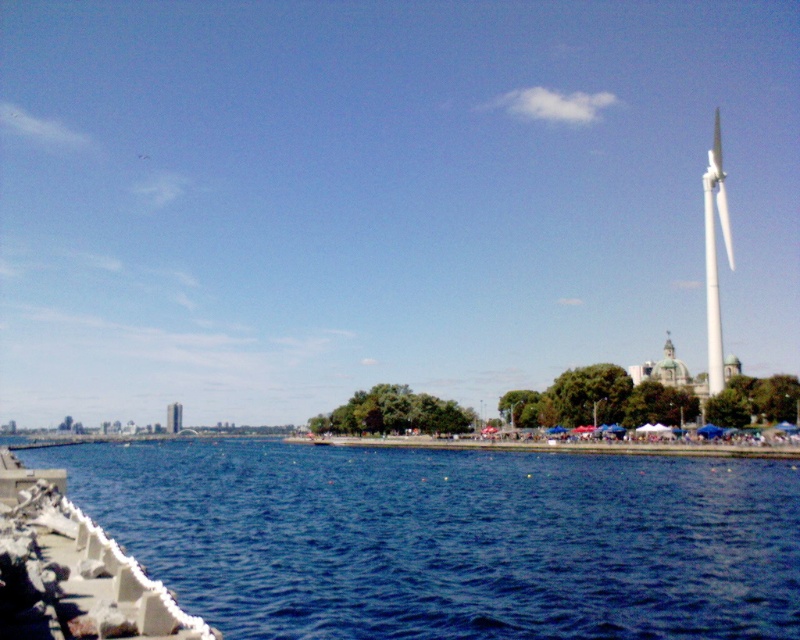
You are a photographer standing at the waterfront. You want to capture a photo that includes both the blue water at lower left and the white smooth wind turbine at right. According to the scene description, where should you position yourself to ensure both elements are in the frame?

You should position yourself to the left of the white smooth wind turbine at right so that the blue water at lower left, which is located below it, can be captured in the lower part of the frame while the turbine remains in the upper right.

You are standing at the point marked as point (x=450, y=538) in the image. What is located at your current position?

At point (x=450, y=538) lies blue water at lower left.